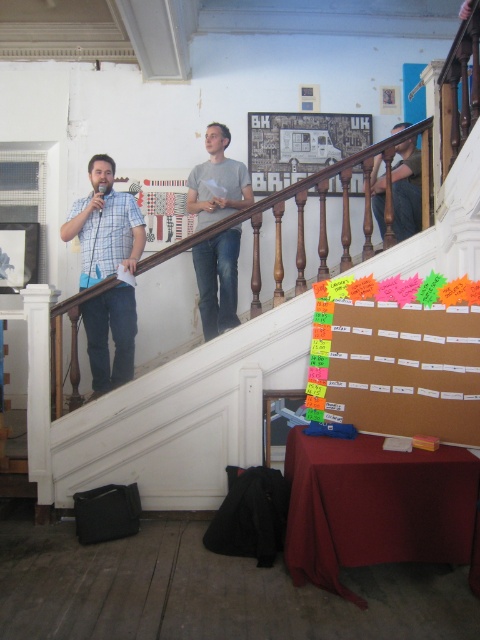
Is point (460, 426) farther from viewer compared to point (119, 342)?

No, it is not.

Is neon paper notes at upper right shorter than matte blue shirt at center?

Yes.

Between point (471, 401) and point (132, 301), which one is positioned in front?

Point (471, 401) is more forward.

Where is `neon paper notes at upper right`? The width and height of the screenshot is (480, 640). neon paper notes at upper right is located at coordinates (396, 356).

Looking at this image, does matte blue shirt at center have a greater width compared to brown leather jacket at upper right?

Correct, the width of matte blue shirt at center exceeds that of brown leather jacket at upper right.

Which is below, matte blue shirt at center or brown leather jacket at upper right?

matte blue shirt at center is lower down.

You are a GUI agent. You are given a task and a screenshot of the screen. Output one action in this format:
    pyautogui.click(x=<x>, y=<y>)
    Task: Click on the matte blue shirt at center
    This screenshot has height=640, width=480.
    Given the screenshot: What is the action you would take?
    pyautogui.click(x=105, y=225)

Between point (103, 364) and point (223, 285), which one is positioned behind?

Positioned behind is point (223, 285).

Is matte blue shirt at center positioned at the back of gray matte shirt at upper center?

No.

The width and height of the screenshot is (480, 640). Find the location of `matte blue shirt at center`. matte blue shirt at center is located at coordinates (105, 225).

Image resolution: width=480 pixels, height=640 pixels. I want to click on matte blue shirt at center, so click(105, 225).